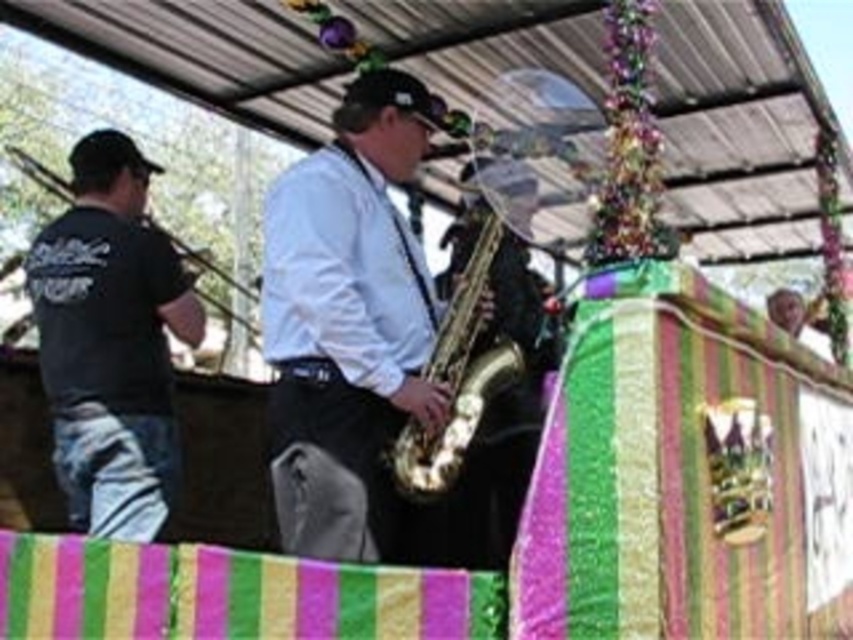
Which is below, shiny gold saxophone at center or black matte shirt at left?

shiny gold saxophone at center is lower down.

Which is above, shiny gold saxophone at center or black matte shirt at left?

black matte shirt at left

This screenshot has height=640, width=853. What do you see at coordinates (363, 348) in the screenshot? I see `shiny gold saxophone at center` at bounding box center [363, 348].

Find the location of `shiny gold saxophone at center`. shiny gold saxophone at center is located at coordinates (x=363, y=348).

Is black matte shirt at left below gold shiny saxophone at center?

Yes, black matte shirt at left is below gold shiny saxophone at center.

Is black matte shirt at left smaller than gold shiny saxophone at center?

Actually, black matte shirt at left might be larger than gold shiny saxophone at center.

What do you see at coordinates (109, 342) in the screenshot?
I see `black matte shirt at left` at bounding box center [109, 342].

Find the location of `black matte shirt at left`. black matte shirt at left is located at coordinates (109, 342).

Between shiny gold saxophone at center and gold shiny saxophone at center, which one has less height?

With less height is gold shiny saxophone at center.

Measure the distance between shiny gold saxophone at center and camera.

shiny gold saxophone at center and camera are 9.78 feet apart from each other.

Locate an element on the screen. This screenshot has width=853, height=640. shiny gold saxophone at center is located at coordinates (363, 348).